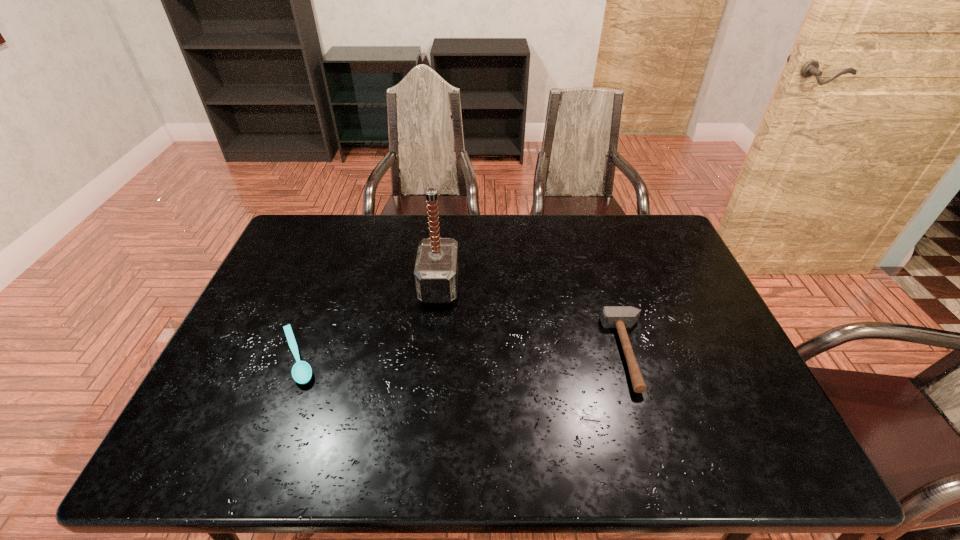
Locate an element on the screen. The height and width of the screenshot is (540, 960). vacant area situated on the back of the leftmost object is located at coordinates (314, 313).

Find the location of a particular element. This screenshot has width=960, height=540. object present at the left edge is located at coordinates (301, 371).

Locate an element on the screen. The height and width of the screenshot is (540, 960). vacant area at the far edge of the desktop is located at coordinates (338, 246).

Where is `free space at the near edge of the desktop`? The height and width of the screenshot is (540, 960). free space at the near edge of the desktop is located at coordinates (607, 458).

In the image, there is a desktop. What are the coordinates of `vacant space at the left edge` in the screenshot? It's located at (274, 357).

In order to click on free location at the right edge of the desktop in this screenshot , I will do `click(697, 389)`.

In the image, there is a desktop. At what (x,y) coordinates should I click in order to perform the action: click on vacant space at the far right corner. Please return your answer as a coordinate pair (x, y). Image resolution: width=960 pixels, height=540 pixels. Looking at the image, I should click on (649, 242).

The width and height of the screenshot is (960, 540). In the image, there is a desktop. What are the coordinates of `vacant area at the near right corner` in the screenshot? It's located at (740, 457).

What are the coordinates of `vacant area that lies between the second tallest object and the leftmost object` in the screenshot? It's located at (464, 355).

At what (x,y) coordinates should I click in order to perform the action: click on blank region between the farthest object and the shorter hammer. Please return your answer as a coordinate pair (x, y). Image resolution: width=960 pixels, height=540 pixels. Looking at the image, I should click on (534, 319).